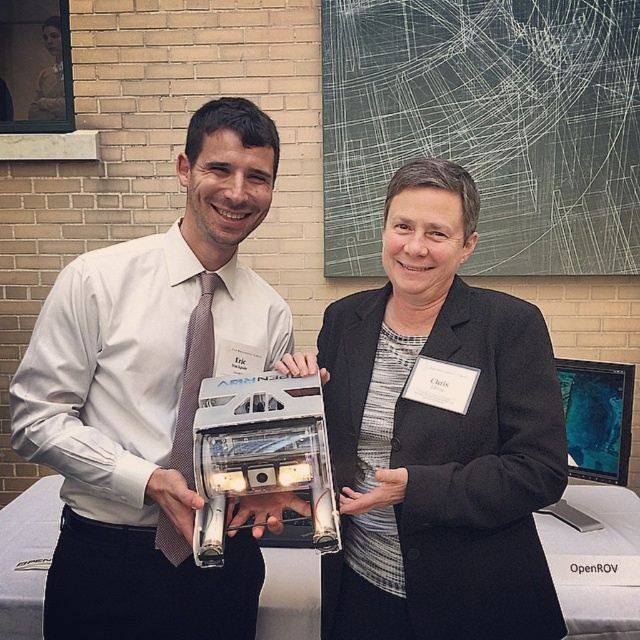
Between matte white shirt at center and matte black jacket at center, which one appears on the left side from the viewer's perspective?

From the viewer's perspective, matte white shirt at center appears more on the left side.

Does point (148, 401) come behind point (419, 456)?

Yes.

Is point (92, 576) positioned after point (392, 595)?

No, (92, 576) is closer to viewer.

Image resolution: width=640 pixels, height=640 pixels. I want to click on matte white shirt at center, so click(154, 400).